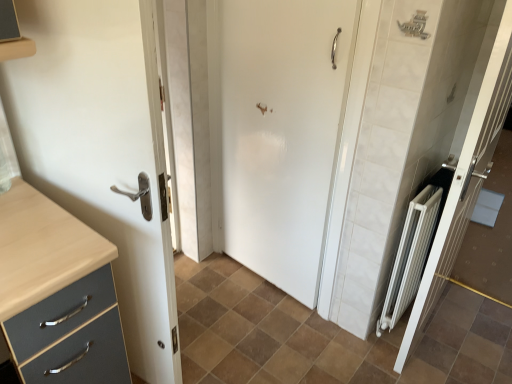
Question: From a real-world perspective, is brown matte tile at center above or below white metallic radiator at right, marked as the 1th door in a right-to-left arrangement?

Choices:
 (A) above
 (B) below

Answer: (B)

Question: From the image's perspective, is brown matte tile at center above or below white metallic radiator at right, marked as the 1th door in a right-to-left arrangement?

Choices:
 (A) below
 (B) above

Answer: (A)

Question: Which is farther from the white metallic radiator at right, marked as the 1th door in a right-to-left arrangement?

Choices:
 (A) brown matte tile at center
 (B) white glossy door at left, which appears as the third door when viewed from the right
 (C) white matte door at center, arranged as the second door when viewed from the right

Answer: (B)

Question: Considering the real-world distances, which object is farthest from the white metallic radiator at right, marked as the 1th door in a right-to-left arrangement?

Choices:
 (A) white matte door at center, arranged as the 2th door when viewed from the left
 (B) white glossy door at left, marked as the 1th door in a left-to-right arrangement
 (C) brown matte tile at center

Answer: (B)